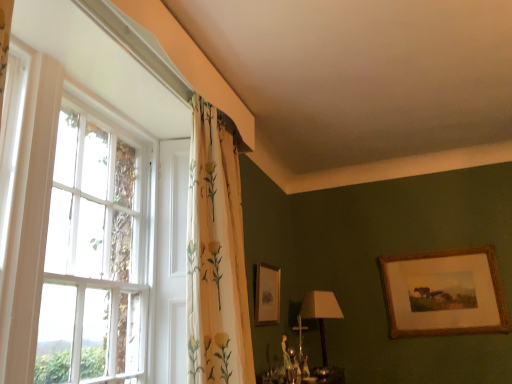
Locate an element on the screen. This screenshot has height=384, width=512. white wooden window at left is located at coordinates (81, 197).

Find the location of a particular element. gold-framed picture at upper right, which is the first picture frame from right to left is located at coordinates (444, 293).

How much space does gold-framed picture at upper right, positioned as the first picture frame in left-to-right order, occupy vertically?

gold-framed picture at upper right, positioned as the first picture frame in left-to-right order, is 15.32 inches in height.

I want to click on gold-framed picture at upper right, the second picture frame positioned from the right, so click(x=266, y=294).

Locate an element on the screen. matte beige lampshade at lower center is located at coordinates (321, 313).

What is the approximate width of matte beige lampshade at lower center?

matte beige lampshade at lower center is 7.39 inches in width.

Identify the location of white wooden window at left. Image resolution: width=512 pixels, height=384 pixels. pyautogui.click(x=81, y=197).

Considering the relative positions of gold-framed picture at upper right, the second picture frame positioned from the right, and white floral fabric curtain at upper left in the image provided, is gold-framed picture at upper right, the second picture frame positioned from the right, to the left or to the right of white floral fabric curtain at upper left?

Clearly, gold-framed picture at upper right, the second picture frame positioned from the right, is on the right of white floral fabric curtain at upper left in the image.

How many degrees apart are the facing directions of gold-framed picture at upper right, the second picture frame positioned from the right, and white floral fabric curtain at upper left?

The angle between the facing direction of gold-framed picture at upper right, the second picture frame positioned from the right, and the facing direction of white floral fabric curtain at upper left is 0.691 degrees.

Which is behind, point (257, 297) or point (211, 371)?

The point (257, 297) is behind.

Are gold-framed picture at upper right, positioned as the first picture frame in left-to-right order, and white floral fabric curtain at upper left beside each other?

gold-framed picture at upper right, positioned as the first picture frame in left-to-right order, is not next to white floral fabric curtain at upper left, and they're not touching.

Locate an element on the screen. The width and height of the screenshot is (512, 384). picture frame that is the 2nd one when counting downward from the white floral fabric curtain at upper left (from the image's perspective) is located at coordinates point(444,293).

Would you say white floral fabric curtain at upper left is part of gold-framed picture at upper right, which is the first picture frame from right to left,'s contents?

No, white floral fabric curtain at upper left is not inside gold-framed picture at upper right, which is the first picture frame from right to left.

Can you confirm if gold-framed picture at upper right, which is counted as the second picture frame, starting from the left, is shorter than white floral fabric curtain at upper left?

Yes.

Who is bigger, gold-framed picture at upper right, which is counted as the second picture frame, starting from the left, or white floral fabric curtain at upper left?

Bigger between the two is white floral fabric curtain at upper left.

Which of these two, white wooden window at left or white floral fabric curtain at upper left, is thinner?

white wooden window at left is thinner.

Identify the location of curtain located below the white wooden window at left (from the image's perspective). Image resolution: width=512 pixels, height=384 pixels. (216, 257).

How different are the orientations of white wooden window at left and white floral fabric curtain at upper left in degrees?

They differ by 0.503 degrees in their facing directions.

From the picture: From a real-world perspective, which is physically above, white wooden window at left or white floral fabric curtain at upper left?

white floral fabric curtain at upper left.

Is gold-framed picture at upper right, the second picture frame positioned from the right, behind white wooden window at left?

Yes, it is behind white wooden window at left.

The width and height of the screenshot is (512, 384). I want to click on window above the gold-framed picture at upper right, the second picture frame positioned from the right (from a real-world perspective), so click(81, 197).

Between gold-framed picture at upper right, the second picture frame positioned from the right, and white wooden window at left, which one appears on the left side from the viewer's perspective?

From the viewer's perspective, white wooden window at left appears more on the left side.

Is gold-framed picture at upper right, which is the first picture frame from right to left, with white wooden window at left?

They are not placed beside each other.

How many degrees apart are the facing directions of gold-framed picture at upper right, which is counted as the second picture frame, starting from the left, and white wooden window at left?

gold-framed picture at upper right, which is counted as the second picture frame, starting from the left, and white wooden window at left are facing 90.1 degrees away from each other.

Considering the relative sizes of gold-framed picture at upper right, which is the first picture frame from right to left, and white wooden window at left in the image provided, is gold-framed picture at upper right, which is the first picture frame from right to left, shorter than white wooden window at left?

Yes.

Does gold-framed picture at upper right, which is the first picture frame from right to left, have a lesser width compared to white wooden window at left?

Indeed, gold-framed picture at upper right, which is the first picture frame from right to left, has a lesser width compared to white wooden window at left.

Is gold-framed picture at upper right, which is the first picture frame from right to left, oriented away from matte beige lampshade at lower center?

That's not correct — gold-framed picture at upper right, which is the first picture frame from right to left, is not looking away from matte beige lampshade at lower center.

Considering the sizes of objects gold-framed picture at upper right, which is counted as the second picture frame, starting from the left, and matte beige lampshade at lower center in the image provided, who is thinner, gold-framed picture at upper right, which is counted as the second picture frame, starting from the left, or matte beige lampshade at lower center?

gold-framed picture at upper right, which is counted as the second picture frame, starting from the left, is thinner.

From the picture: From a real-world perspective, does gold-framed picture at upper right, which is the first picture frame from right to left, stand above matte beige lampshade at lower center?

Yes, from a real-world perspective, gold-framed picture at upper right, which is the first picture frame from right to left, is on top of matte beige lampshade at lower center.

Does gold-framed picture at upper right, which is counted as the second picture frame, starting from the left, contain matte beige lampshade at lower center?

No, matte beige lampshade at lower center is located outside of gold-framed picture at upper right, which is counted as the second picture frame, starting from the left.

Is gold-framed picture at upper right, which is the first picture frame from right to left, spatially inside gold-framed picture at upper right, the second picture frame positioned from the right, or outside of it?

gold-framed picture at upper right, which is the first picture frame from right to left, is not enclosed by gold-framed picture at upper right, the second picture frame positioned from the right.

From a real-world perspective, is gold-framed picture at upper right, which is counted as the second picture frame, starting from the left, positioned above or below gold-framed picture at upper right, the second picture frame positioned from the right?

gold-framed picture at upper right, which is counted as the second picture frame, starting from the left, is situated lower than gold-framed picture at upper right, the second picture frame positioned from the right, in the real world.

From the image's perspective, would you say gold-framed picture at upper right, which is the first picture frame from right to left, is shown under gold-framed picture at upper right, the second picture frame positioned from the right?

Correct, gold-framed picture at upper right, which is the first picture frame from right to left, appears lower than gold-framed picture at upper right, the second picture frame positioned from the right, in the image.

Is gold-framed picture at upper right, which is counted as the second picture frame, starting from the left, to the left or to the right of gold-framed picture at upper right, the second picture frame positioned from the right, in the image?

In the image, gold-framed picture at upper right, which is counted as the second picture frame, starting from the left, appears on the right side of gold-framed picture at upper right, the second picture frame positioned from the right.

Find the location of `curtain above the gold-framed picture at upper right, positioned as the first picture frame in left-to-right order (from a real-world perspective)`. curtain above the gold-framed picture at upper right, positioned as the first picture frame in left-to-right order (from a real-world perspective) is located at coordinates (216, 257).

This screenshot has width=512, height=384. Identify the location of curtain in front of the gold-framed picture at upper right, which is counted as the second picture frame, starting from the left. (216, 257).

When comparing their distances from white floral fabric curtain at upper left, does white wooden window at left or gold-framed picture at upper right, positioned as the first picture frame in left-to-right order, seem further?

gold-framed picture at upper right, positioned as the first picture frame in left-to-right order, lies further to white floral fabric curtain at upper left than the other object.

Based on their spatial positions, is gold-framed picture at upper right, positioned as the first picture frame in left-to-right order, or white floral fabric curtain at upper left further from gold-framed picture at upper right, which is counted as the second picture frame, starting from the left?

Based on the image, white floral fabric curtain at upper left appears to be further to gold-framed picture at upper right, which is counted as the second picture frame, starting from the left.

Looking at this image, when comparing their distances from white wooden window at left, does gold-framed picture at upper right, positioned as the first picture frame in left-to-right order, or white floral fabric curtain at upper left seem closer?

Answer: white floral fabric curtain at upper left is positioned closer to the anchor white wooden window at left.

Based on their spatial positions, is gold-framed picture at upper right, which is counted as the second picture frame, starting from the left, or white floral fabric curtain at upper left further from white wooden window at left?

gold-framed picture at upper right, which is counted as the second picture frame, starting from the left.

Based on their spatial positions, is white floral fabric curtain at upper left or gold-framed picture at upper right, which is counted as the second picture frame, starting from the left, closer to gold-framed picture at upper right, positioned as the first picture frame in left-to-right order?

Based on the image, white floral fabric curtain at upper left appears to be nearer to gold-framed picture at upper right, positioned as the first picture frame in left-to-right order.

Estimate the real-world distances between objects in this image. Which object is further from gold-framed picture at upper right, positioned as the first picture frame in left-to-right order, matte beige lampshade at lower center or white floral fabric curtain at upper left?

The object further to gold-framed picture at upper right, positioned as the first picture frame in left-to-right order, is white floral fabric curtain at upper left.

Based on their spatial positions, is gold-framed picture at upper right, the second picture frame positioned from the right, or white wooden window at left further from matte beige lampshade at lower center?

white wooden window at left.

Looking at the image, which one is located closer to matte beige lampshade at lower center, white floral fabric curtain at upper left or gold-framed picture at upper right, the second picture frame positioned from the right?

gold-framed picture at upper right, the second picture frame positioned from the right, lies closer to matte beige lampshade at lower center than the other object.

Locate an element on the screen. This screenshot has width=512, height=384. table lamp between gold-framed picture at upper right, positioned as the first picture frame in left-to-right order, and gold-framed picture at upper right, which is counted as the second picture frame, starting from the left, from left to right is located at coordinates (321, 313).

The image size is (512, 384). In order to click on picture frame located between white floral fabric curtain at upper left and gold-framed picture at upper right, which is counted as the second picture frame, starting from the left, in the left-right direction in this screenshot , I will do `click(266, 294)`.

This screenshot has width=512, height=384. Identify the location of picture frame located between white wooden window at left and gold-framed picture at upper right, which is the first picture frame from right to left, in the left-right direction. (266, 294).

Where is `table lamp located between white wooden window at left and gold-framed picture at upper right, which is the first picture frame from right to left, in the left-right direction`? table lamp located between white wooden window at left and gold-framed picture at upper right, which is the first picture frame from right to left, in the left-right direction is located at coordinates (321, 313).